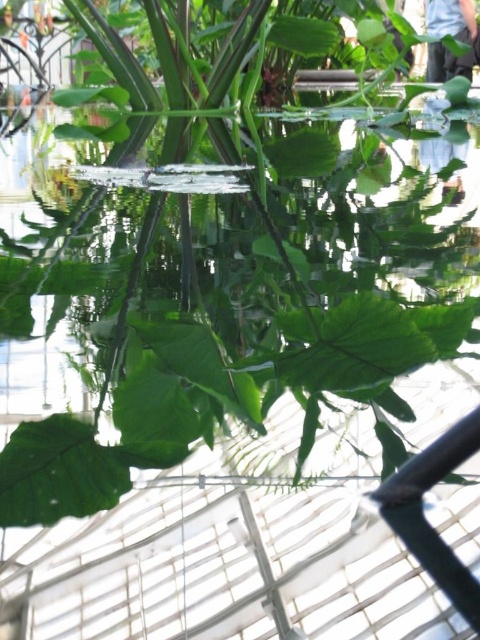
Which is above, transparent liquid water at center or blue jeans at upper right?

blue jeans at upper right

Is transparent liquid water at center to the right of blue jeans at upper right from the viewer's perspective?

Incorrect, transparent liquid water at center is not on the right side of blue jeans at upper right.

The height and width of the screenshot is (640, 480). What do you see at coordinates (233, 321) in the screenshot?
I see `transparent liquid water at center` at bounding box center [233, 321].

Locate an element on the screen. transparent liquid water at center is located at coordinates (233, 321).